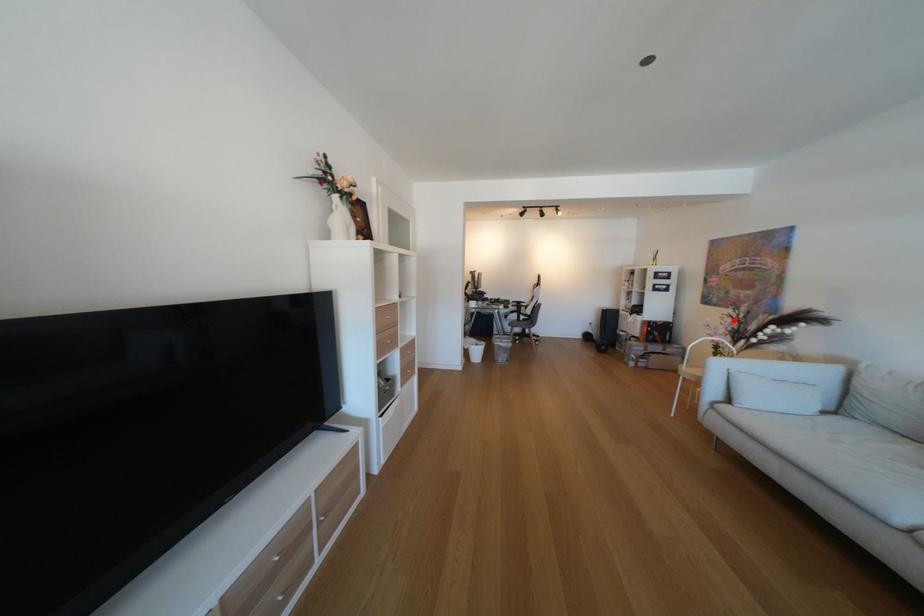
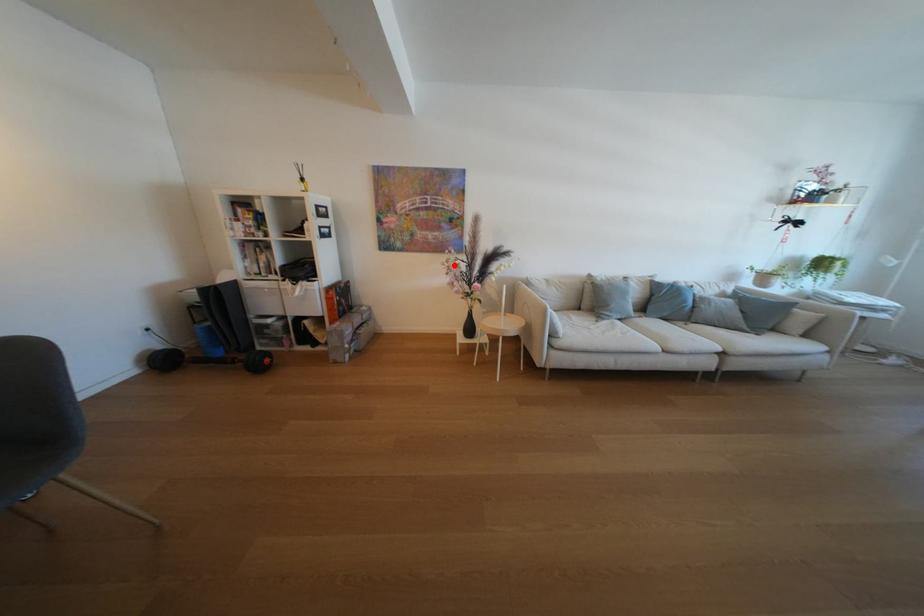
I am providing you with two images of the same scene from different viewpoints. A red point is marked on the first image and another point is marked on the second image. Is the red point in image1 aligned with the point shown in image2?

Yes